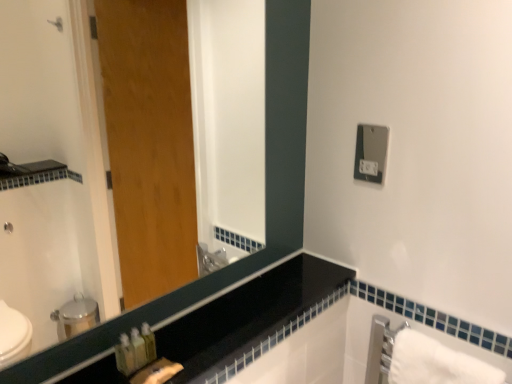
Question: From the image's perspective, is satin silver outlet at upper right above or below white cotton bath towel at lower right?

Choices:
 (A) above
 (B) below

Answer: (A)

Question: Considering their positions, is satin silver outlet at upper right located in front of or behind white cotton bath towel at lower right?

Choices:
 (A) behind
 (B) front

Answer: (A)

Question: Considering the real-world distances, which object is farthest from the satin silver outlet at upper right?

Choices:
 (A) black glossy counter top at lower left
 (B) white cotton bath towel at lower right
 (C) black glass mirror at upper left

Answer: (B)

Question: Considering the real-world distances, which object is closest to the satin silver outlet at upper right?

Choices:
 (A) black glass mirror at upper left
 (B) black glossy counter top at lower left
 (C) white cotton bath towel at lower right

Answer: (A)